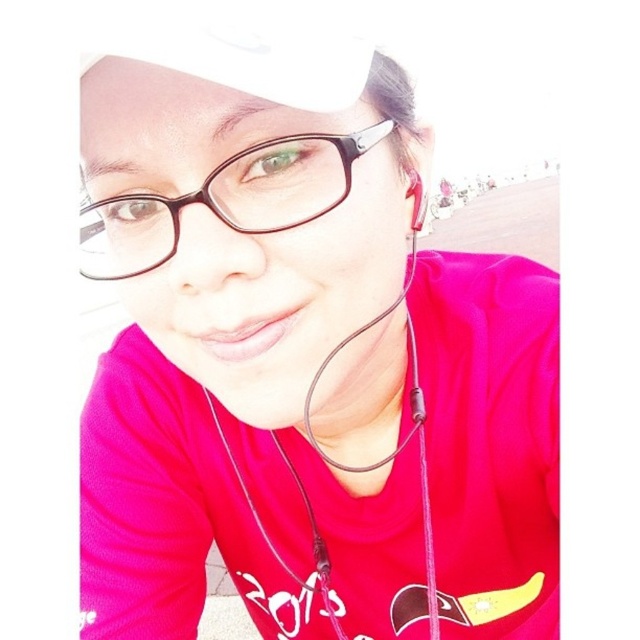
You are a photographer trying to capture a portrait of the person wearing the bright pink shirt. You notice the matte black earphones at center and the matte black earphone at upper center in the frame. Which earphone appears closer to you in the photo?

The matte black earphones at center appears closer to you because it is in front of the matte black earphone at upper center in the image.

You are a photographer trying to capture a close shot of the black plastic glasses at center and the matte black earphone at upper center. Which object would require a wider aperture setting to ensure proper focus on the subject while blurring the background?

The black plastic glasses at center would require a wider aperture setting because its width is larger than the matte black earphone at upper center, necessitating a shallower depth of field to keep it in focus while blurring the background.